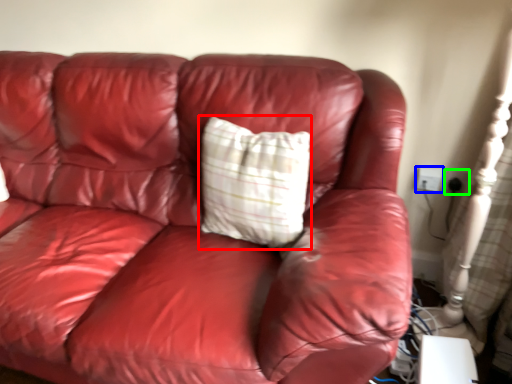
Question: Which is nearer to the pillow (highlighted by a red box)? electric outlet (highlighted by a blue box) or electric outlet (highlighted by a green box).

Choices:
 (A) electric outlet
 (B) electric outlet

Answer: (A)